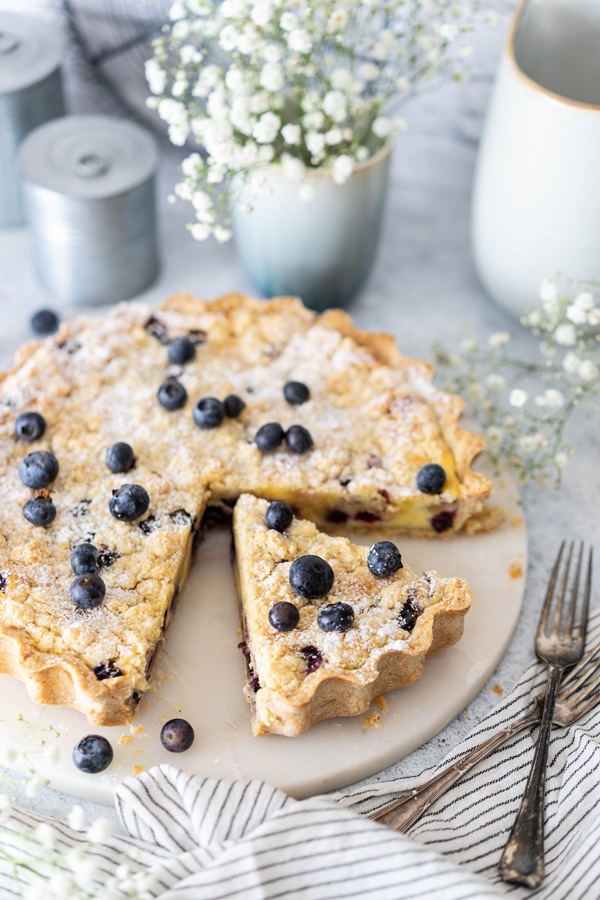
You are a GUI agent. You are given a task and a screenshot of the screen. Output one action in this format:
    pyautogui.click(x=<x>, y=<y>)
    Task: Click on the white pitcher
    This screenshot has width=600, height=900.
    Given the screenshot: What is the action you would take?
    pyautogui.click(x=557, y=165)